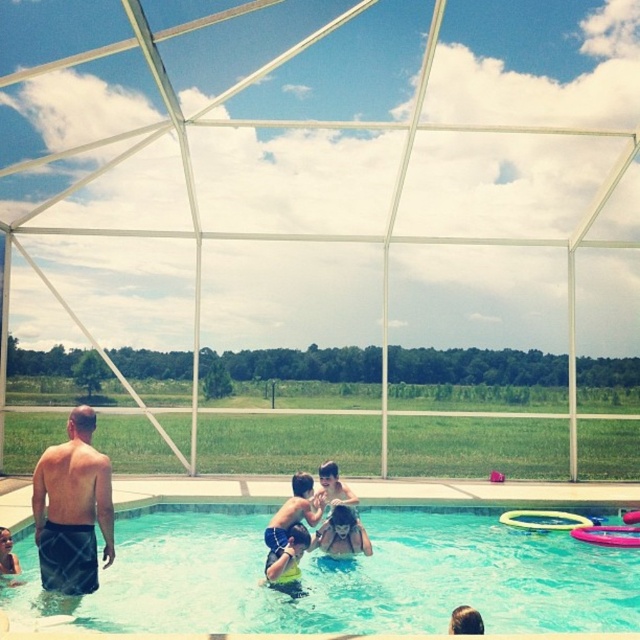
Question: Which point is farther to the camera?

Choices:
 (A) click(272, 580)
 (B) click(320, 541)
 (C) click(403, 516)

Answer: (C)

Question: Where is dark blue shorts at lower left located in relation to yellow-green swimsuit at center in the image?

Choices:
 (A) right
 (B) left

Answer: (B)

Question: In this image, where is yellow-green swimsuit at center located relative to yellow rubber ring at center?

Choices:
 (A) right
 (B) left

Answer: (B)

Question: Estimate the real-world distances between objects in this image. Which object is closer to the blue glossy water at center?

Choices:
 (A) dark blue shorts at lower left
 (B) yellow rubber ring at center

Answer: (B)

Question: Which of the following is the closest to the observer?

Choices:
 (A) yellow-green swimsuit at center
 (B) yellow rubber ring at center
 (C) dark blue shorts at lower left

Answer: (C)

Question: Is blue glossy water at center to the right of yellow-green swimsuit at center from the viewer's perspective?

Choices:
 (A) no
 (B) yes

Answer: (B)